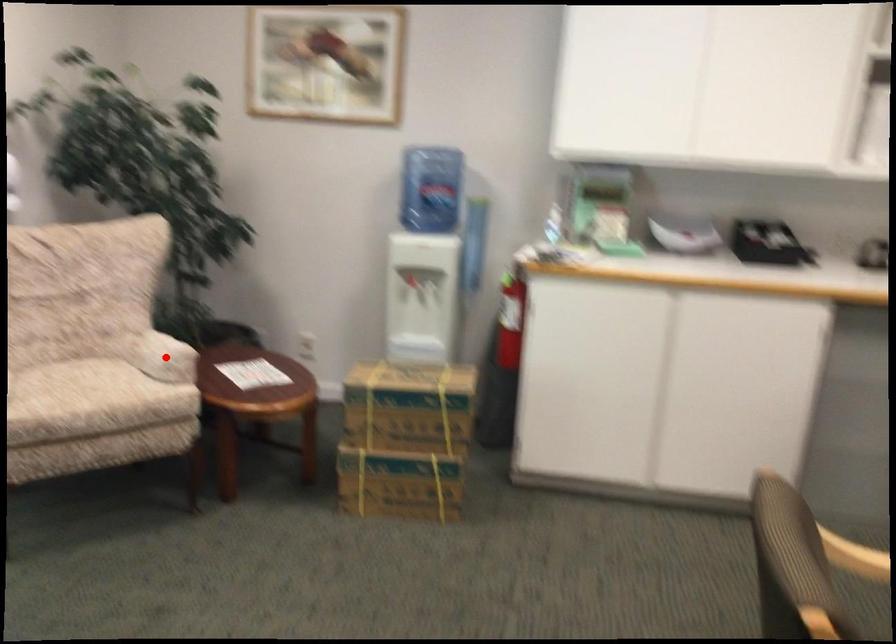
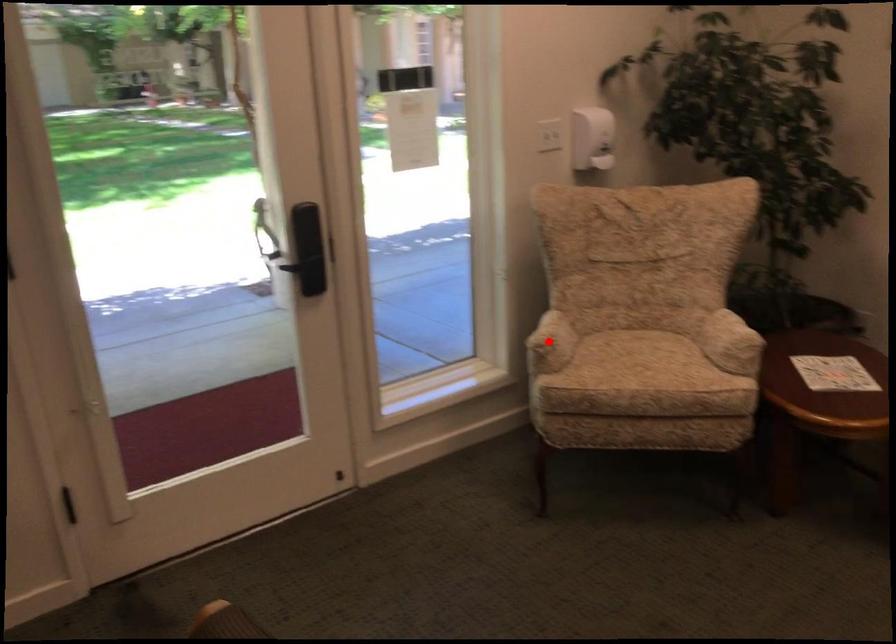
I am providing you with two images of the same scene from different viewpoints. A red point is marked on the first image and another point is marked on the second image. Do the highlighted points in image1 and image2 indicate the same real-world spot?

No